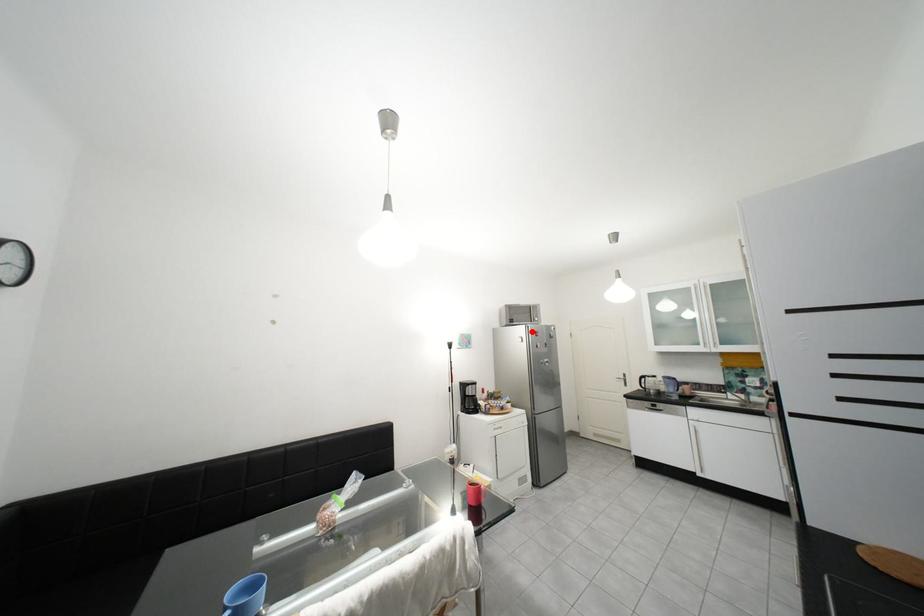
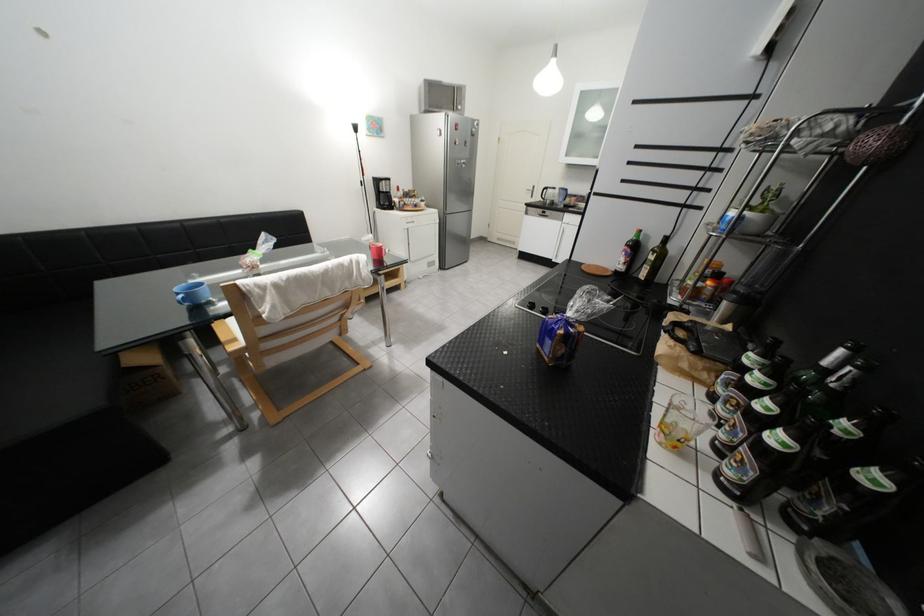
Find the pixel in the second image that matches the highlighted location in the first image.

(451, 121)